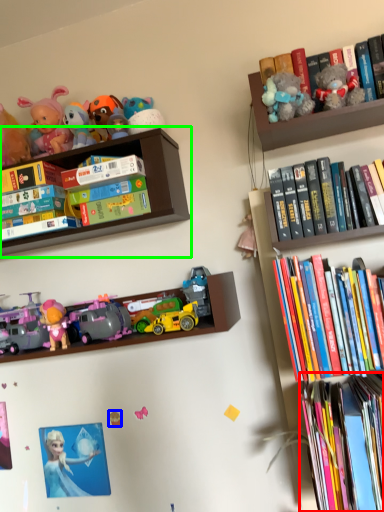
Question: Estimate the real-world distances between objects in this image. Which object is farther from book (highlighted by a red box), toy (highlighted by a blue box) or shelf (highlighted by a green box)?

Choices:
 (A) toy
 (B) shelf

Answer: (B)